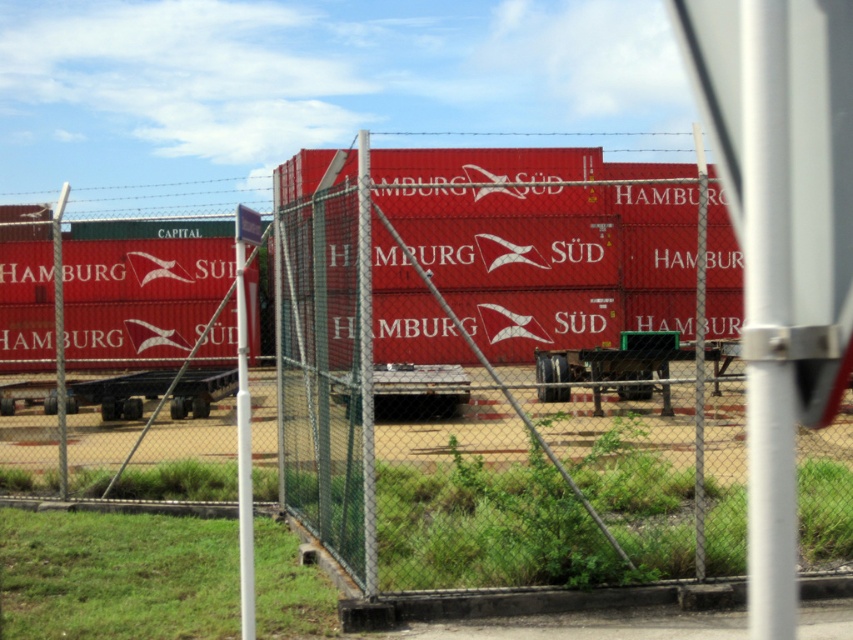
You are a delivery driver arriving at the fenced area. You see a metal mesh fence at center and a green metallic trailer truck at center. Which object is closer to the entrance gate? Please explain your reasoning based on their positions.

The metal mesh fence at center is closer to the entrance gate because it is positioned to the left of the green metallic trailer truck at center, implying it is nearer to the entrance compared to the truck.

You are a delivery driver approaching the entrance of the fenced area. You see the metal mesh fence at center and the green metallic trailer truck at center. Can you drive through the space between them? Explain why or why not based on their positions.

The metal mesh fence at center is above the green metallic trailer truck at center, meaning the fence is positioned higher than the truck. Since the fence is above the truck, there is enough vertical clearance for the truck to pass underneath the fence without any obstruction. Therefore, you can drive through the space between them as long as there is sufficient horizontal space available.

You are a delivery driver arriving at the fenced area. You see a metal mesh fence at center and a metallic trailer truck at center. Which object is closer to you as you approach the area?

The metal mesh fence at center is closer to you because it is positioned over the metallic trailer truck at center, indicating it is in front of the truck.